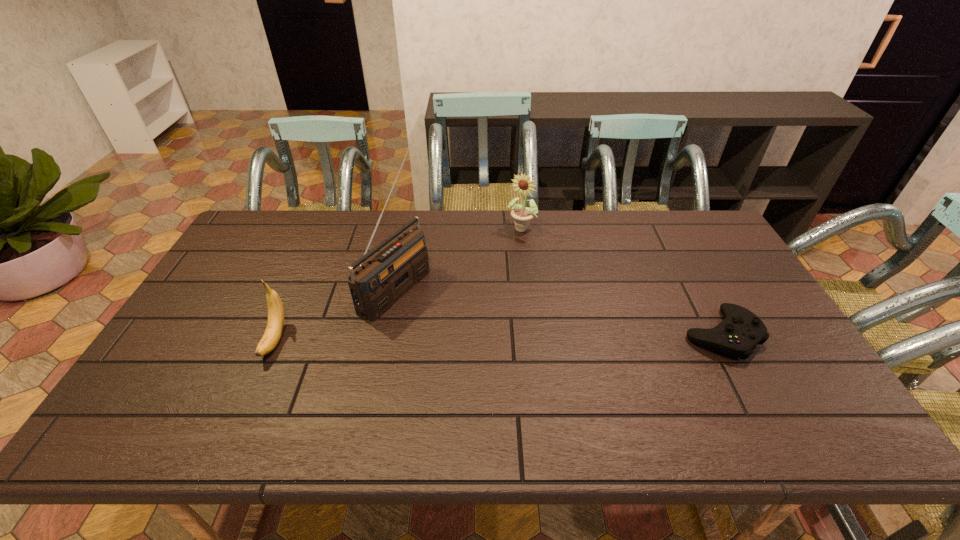
Where is `vacant region at the left edge of the desktop`? vacant region at the left edge of the desktop is located at coordinates (251, 292).

The width and height of the screenshot is (960, 540). Identify the location of vacant space at the far right corner. (678, 225).

This screenshot has height=540, width=960. I want to click on vacant space at the near right corner of the desktop, so click(x=813, y=382).

Identify the location of vacant region between the rightmost object and the third shortest object. This screenshot has width=960, height=540. (621, 281).

Where is `free space that is in between the leftmost object and the shortest object`? The image size is (960, 540). free space that is in between the leftmost object and the shortest object is located at coordinates (498, 337).

I want to click on unoccupied position between the banana and the control, so click(x=498, y=337).

Locate an element on the screen. The width and height of the screenshot is (960, 540). free space that is in between the control and the farthest object is located at coordinates (621, 281).

Find the location of a particular element. The width and height of the screenshot is (960, 540). free space between the shortest object and the farthest object is located at coordinates (621, 281).

I want to click on free spot between the tallest object and the third shortest object, so click(x=459, y=258).

Identify the location of object that can be found as the second closest to the tallest object. (522, 215).